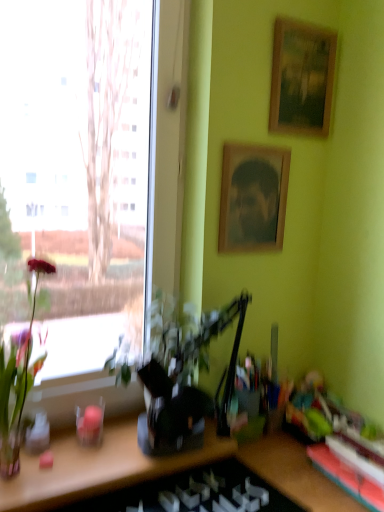
Question: Is green glossy plant at left, arranged as the first houseplant when viewed from the left, to the left of rubberized green toy at lower right from the viewer's perspective?

Choices:
 (A) no
 (B) yes

Answer: (B)

Question: Is green glossy plant at left, arranged as the first houseplant when viewed from the left, positioned beyond the bounds of rubberized green toy at lower right?

Choices:
 (A) yes
 (B) no

Answer: (A)

Question: Does green glossy plant at left, the second houseplant positioned from the right, have a lesser height compared to rubberized green toy at lower right?

Choices:
 (A) yes
 (B) no

Answer: (B)

Question: Can rubberized green toy at lower right be found inside green glossy plant at left, the second houseplant positioned from the right?

Choices:
 (A) yes
 (B) no

Answer: (B)

Question: From a real-world perspective, is green glossy plant at left, arranged as the first houseplant when viewed from the left, on rubberized green toy at lower right?

Choices:
 (A) yes
 (B) no

Answer: (A)

Question: Is rubberized green toy at lower right in front of or behind wooden framed picture at upper right, the second picture frame ordered from the bottom, in the image?

Choices:
 (A) front
 (B) behind

Answer: (B)

Question: Is rubberized green toy at lower right inside or outside of wooden framed picture at upper right, the second picture frame ordered from the bottom?

Choices:
 (A) outside
 (B) inside

Answer: (A)

Question: Based on their sizes in the image, would you say rubberized green toy at lower right is bigger or smaller than wooden framed picture at upper right, which ranks as the 1th picture frame in top-to-bottom order?

Choices:
 (A) small
 (B) big

Answer: (A)

Question: From the image's perspective, relative to wooden framed picture at upper right, the second picture frame ordered from the bottom, is rubberized green toy at lower right above or below?

Choices:
 (A) below
 (B) above

Answer: (A)

Question: Considering the relative positions of green leafy plant at left, positioned as the 2th houseplant in left-to-right order, and transparent glass window at left in the image provided, is green leafy plant at left, positioned as the 2th houseplant in left-to-right order, to the left or to the right of transparent glass window at left?

Choices:
 (A) right
 (B) left

Answer: (A)

Question: Considering the positions of green leafy plant at left, which is the 1th houseplant in right-to-left order, and transparent glass window at left in the image, is green leafy plant at left, which is the 1th houseplant in right-to-left order, bigger or smaller than transparent glass window at left?

Choices:
 (A) small
 (B) big

Answer: (A)

Question: From the image's perspective, is green leafy plant at left, which is the 1th houseplant in right-to-left order, positioned above or below transparent glass window at left?

Choices:
 (A) below
 (B) above

Answer: (A)

Question: From a real-world perspective, is green leafy plant at left, positioned as the 2th houseplant in left-to-right order, physically located above or below transparent glass window at left?

Choices:
 (A) below
 (B) above

Answer: (A)

Question: Is green glossy plant at left, the second houseplant positioned from the right, to the left or to the right of transparent glass window at left in the image?

Choices:
 (A) right
 (B) left

Answer: (B)

Question: From the image's perspective, relative to transparent glass window at left, is green glossy plant at left, the second houseplant positioned from the right, above or below?

Choices:
 (A) below
 (B) above

Answer: (A)